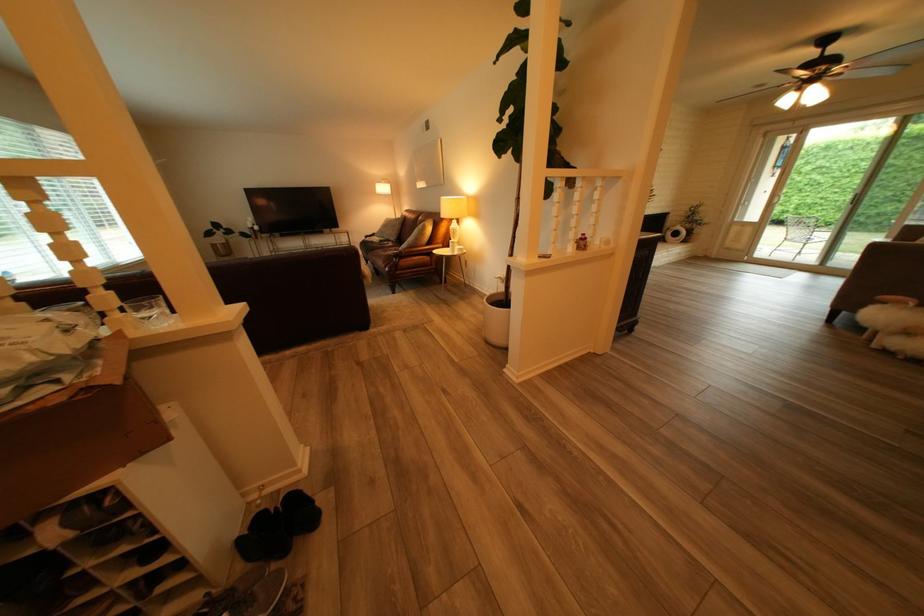
Locate an element on the screen. white door handle is located at coordinates (774, 198).